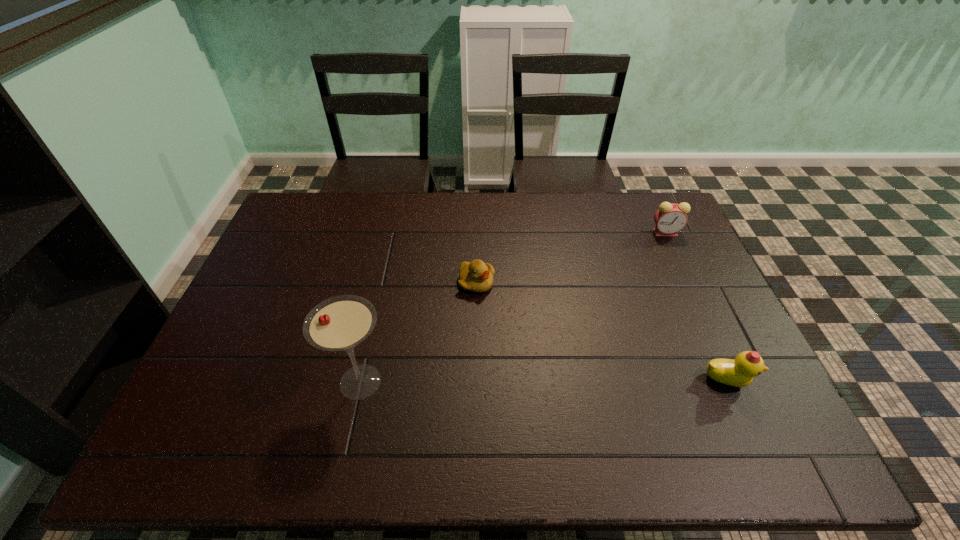
In order to click on vacant region that satisfies the following two spatial constraints: 1. on the front side of the nearer duckling; 2. on the front-facing side of the shortest object in this screenshot , I will do `click(476, 381)`.

Where is `vacant space that satisfies the following two spatial constraints: 1. on the back side of the leftmost object; 2. on the front-facing side of the nearer duckling`? This screenshot has width=960, height=540. vacant space that satisfies the following two spatial constraints: 1. on the back side of the leftmost object; 2. on the front-facing side of the nearer duckling is located at coordinates (361, 381).

Find the location of `vacant area in the image that satisfies the following two spatial constraints: 1. on the front side of the right duckling; 2. on the front-facing side of the shorter duckling`. vacant area in the image that satisfies the following two spatial constraints: 1. on the front side of the right duckling; 2. on the front-facing side of the shorter duckling is located at coordinates (476, 381).